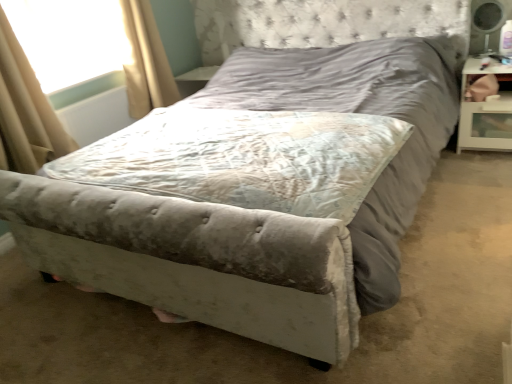
Question: From a real-world perspective, is transparent plastic window screen at upper left physically located above or below white glossy nightstand at right?

Choices:
 (A) above
 (B) below

Answer: (A)

Question: From the image's perspective, is transparent plastic window screen at upper left located above or below white glossy nightstand at right?

Choices:
 (A) below
 (B) above

Answer: (B)

Question: Which of these objects is positioned farthest from the transparent plastic window screen at upper left?

Choices:
 (A) white glossy nightstand at right
 (B) beige fabric curtain at left, which is the 1th curtain in left-to-right order
 (C) beige fabric curtain at upper left, the first curtain positioned from the right
 (D) velvet gray mattress at center

Answer: (A)

Question: Which of these objects is positioned farthest from the beige fabric curtain at left, acting as the first curtain starting from the front?

Choices:
 (A) beige fabric curtain at upper left, the first curtain positioned from the right
 (B) transparent plastic window screen at upper left
 (C) white glossy nightstand at right
 (D) velvet gray mattress at center

Answer: (C)